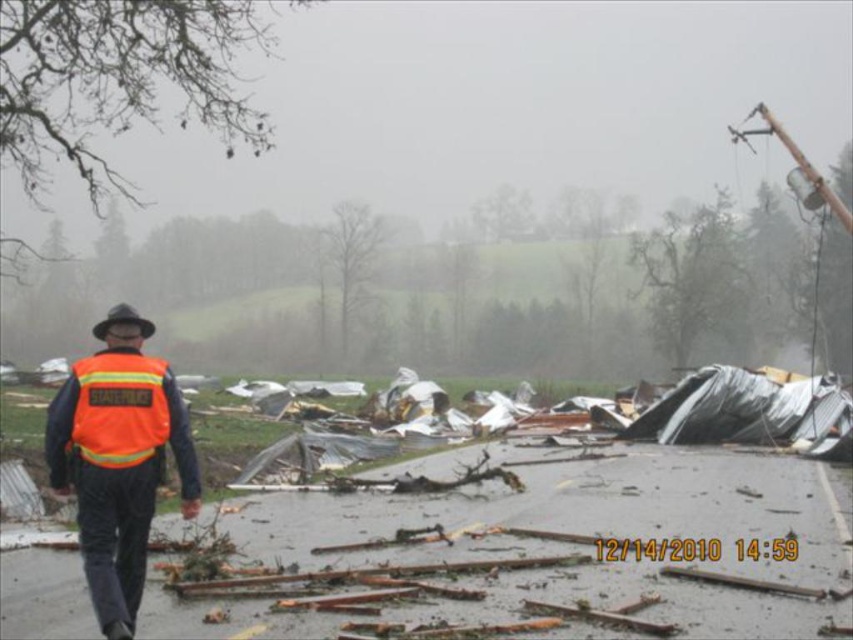
Question: Which point is closer to the camera?

Choices:
 (A) orange reflective safety vest at left
 (B) orange reflective vest at left
 (C) black felt hat at upper left

Answer: (A)

Question: Which object is closer to the camera taking this photo?

Choices:
 (A) orange reflective vest at left
 (B) black felt hat at upper left

Answer: (A)

Question: Considering the relative positions of orange reflective vest at left and black felt hat at upper left in the image provided, where is orange reflective vest at left located with respect to black felt hat at upper left?

Choices:
 (A) below
 (B) above

Answer: (A)

Question: Which object is positioned farthest from the black felt hat at upper left?

Choices:
 (A) orange reflective vest at left
 (B) orange reflective safety vest at left

Answer: (A)

Question: Where is orange reflective vest at left located in relation to orange reflective safety vest at left in the image?

Choices:
 (A) below
 (B) above

Answer: (A)

Question: Is orange reflective vest at left wider than black felt hat at upper left?

Choices:
 (A) no
 (B) yes

Answer: (A)